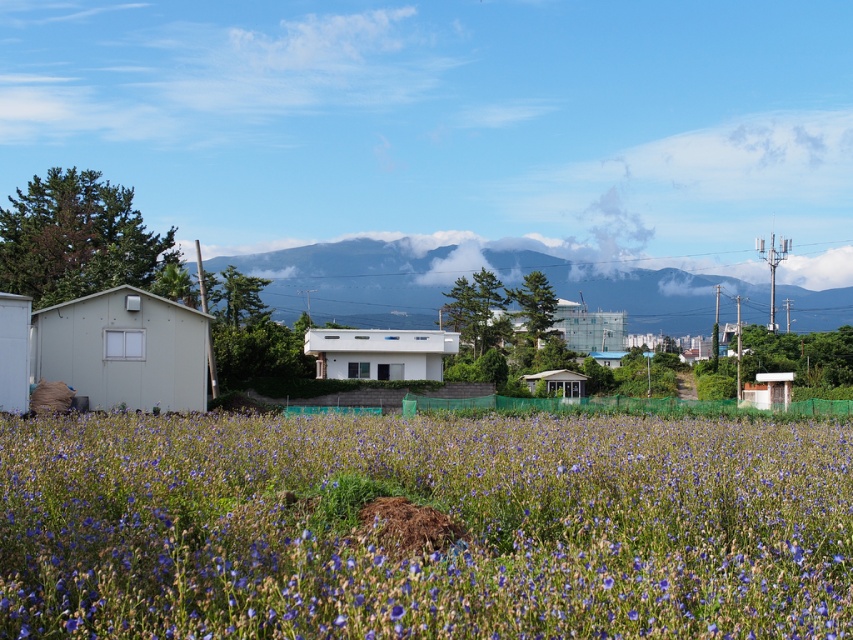
Is blue matte flowers at center thinner than white plastic hut at right?

In fact, blue matte flowers at center might be wider than white plastic hut at right.

Which is behind, point (120, 428) or point (788, 388)?

The point (788, 388) is behind.

Locate an element on the screen. This screenshot has height=640, width=853. blue matte flowers at center is located at coordinates (434, 508).

Find the location of a particular element. This screenshot has width=853, height=640. blue matte flowers at center is located at coordinates (434, 508).

Between white matte hut at left and white matte hut at center, which one has less height?

Standing shorter between the two is white matte hut at left.

Can you confirm if white matte hut at left is shorter than white matte hut at center?

Yes.

This screenshot has height=640, width=853. Describe the element at coordinates (13, 352) in the screenshot. I see `white matte hut at left` at that location.

Find the location of a particular element. white matte hut at left is located at coordinates (13, 352).

How distant is white matte house at center from white plastic hut at right?

white matte house at center and white plastic hut at right are 24.78 meters apart.

Who is higher up, white matte house at center or white plastic hut at right?

white matte house at center

You are a GUI agent. You are given a task and a screenshot of the screen. Output one action in this format:
    pyautogui.click(x=<x>, y=<y>)
    Task: Click on the white matte house at center
    The image size is (853, 640).
    Given the screenshot: What is the action you would take?
    pyautogui.click(x=379, y=353)